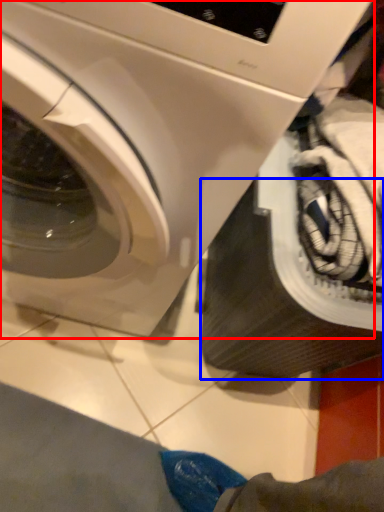
Question: Which object appears closest to the camera in this image, washing machine (highlighted by a red box) or tire (highlighted by a blue box)?

Choices:
 (A) washing machine
 (B) tire

Answer: (A)